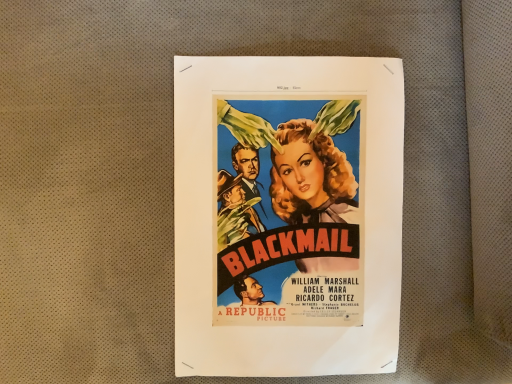
Find the location of a particular element. The width and height of the screenshot is (512, 384). vacant point above matte paper poster at center (from a real-world perspective) is located at coordinates (284, 149).